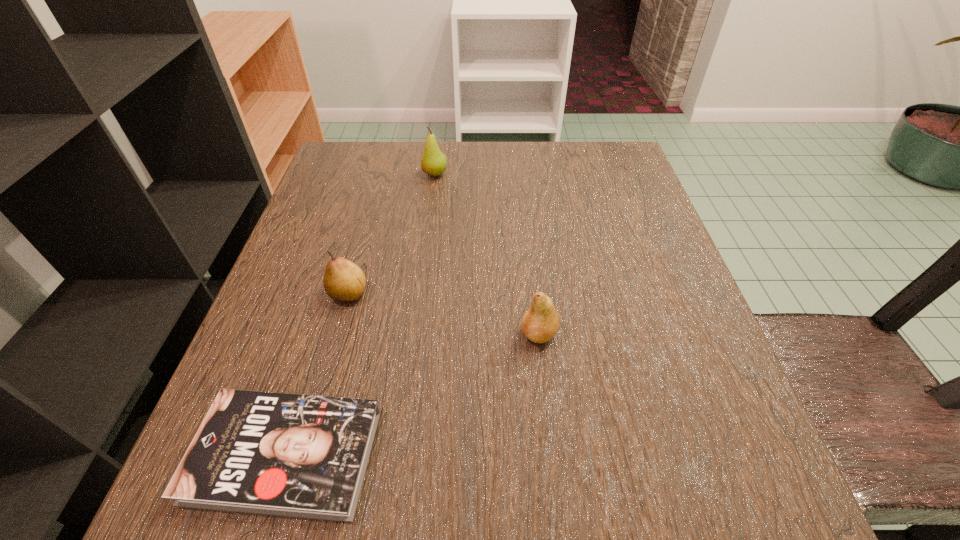
Image resolution: width=960 pixels, height=540 pixels. Find the location of `vacant space situated on the right of the third nearest object`. vacant space situated on the right of the third nearest object is located at coordinates (500, 293).

Find the location of `vacant space located on the back of the shortest object`. vacant space located on the back of the shortest object is located at coordinates (350, 242).

This screenshot has height=540, width=960. Find the location of `object situated at the far edge`. object situated at the far edge is located at coordinates (433, 162).

Identify the location of object located in the near edge section of the desktop. (293, 455).

Locate an element on the screen. pear that is at the left edge is located at coordinates (344, 281).

Locate an element on the screen. This screenshot has height=540, width=960. book present at the left edge is located at coordinates (293, 455).

This screenshot has height=540, width=960. Identify the location of object located at the near left corner. (293, 455).

In the image, there is a desktop. Where is `vacant space at the far edge`? vacant space at the far edge is located at coordinates pyautogui.click(x=421, y=171).

At what (x,y) coordinates should I click in order to perform the action: click on free region at the left edge of the desktop. Please return your answer as a coordinate pair (x, y). Image resolution: width=960 pixels, height=540 pixels. Looking at the image, I should click on (336, 219).

Locate an element on the screen. The height and width of the screenshot is (540, 960). vacant space at the right edge is located at coordinates (654, 269).